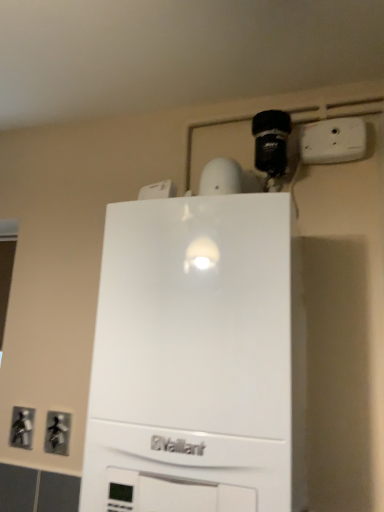
Question: Would you say metallic gray outlet at lower left, arranged as the second electric outlet when ordered from the bottom, is a long distance from metallic silver outlet at lower left, acting as the 1th electric outlet starting from the back?

Choices:
 (A) no
 (B) yes

Answer: (A)

Question: Is metallic gray outlet at lower left, which appears as the 2th electric outlet when viewed from the front, located outside metallic silver outlet at lower left, the 3th electric outlet from the top?

Choices:
 (A) no
 (B) yes

Answer: (B)

Question: Is metallic gray outlet at lower left, arranged as the second electric outlet when ordered from the bottom, to the right of metallic silver outlet at lower left, the 3th electric outlet from the top, from the viewer's perspective?

Choices:
 (A) no
 (B) yes

Answer: (B)

Question: Is metallic gray outlet at lower left, marked as the 2th electric outlet in a back-to-front arrangement, to the left of metallic silver outlet at lower left, positioned as the first electric outlet in left-to-right order, from the viewer's perspective?

Choices:
 (A) no
 (B) yes

Answer: (A)

Question: From a real-world perspective, is metallic gray outlet at lower left, which is counted as the second electric outlet, starting from the top, physically above metallic silver outlet at lower left, the 3th electric outlet from the right?

Choices:
 (A) yes
 (B) no

Answer: (B)

Question: From the image's perspective, would you say metallic gray outlet at lower left, acting as the second electric outlet starting from the left, is positioned over metallic silver outlet at lower left, which is counted as the 1th electric outlet, starting from the bottom?

Choices:
 (A) yes
 (B) no

Answer: (A)

Question: Is white plastic electric outlet at upper center, arranged as the 1th electric outlet when viewed from the top, completely or partially outside of white matte vaillant boiler at center?

Choices:
 (A) no
 (B) yes

Answer: (B)

Question: Is white plastic electric outlet at upper center, the third electric outlet when ordered from left to right, facing away from white matte vaillant boiler at center?

Choices:
 (A) yes
 (B) no

Answer: (B)

Question: Is the depth of white plastic electric outlet at upper center, the first electric outlet positioned from the front, less than that of white matte vaillant boiler at center?

Choices:
 (A) yes
 (B) no

Answer: (B)

Question: Is white plastic electric outlet at upper center, which is counted as the 3th electric outlet, starting from the back, next to white matte vaillant boiler at center?

Choices:
 (A) yes
 (B) no

Answer: (B)

Question: Is white matte vaillant boiler at center a part of white plastic electric outlet at upper center, the 1th electric outlet positioned from the right?

Choices:
 (A) no
 (B) yes

Answer: (A)

Question: Could you tell me if white plastic electric outlet at upper center, arranged as the 1th electric outlet when viewed from the top, is turned towards white matte vaillant boiler at center?

Choices:
 (A) no
 (B) yes

Answer: (A)

Question: Is the depth of metallic silver outlet at lower left, the 3th electric outlet from the right, greater than that of white plastic electric outlet at upper center, the 1th electric outlet positioned from the right?

Choices:
 (A) no
 (B) yes

Answer: (B)